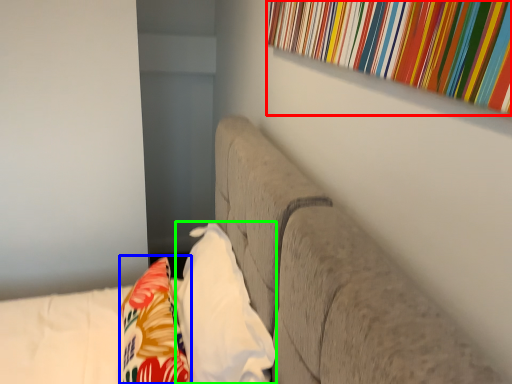
Question: Estimate the real-world distances between objects in this image. Which object is closer to curtain (highlighted by a red box), throw pillow (highlighted by a blue box) or pillow (highlighted by a green box)?

Choices:
 (A) throw pillow
 (B) pillow

Answer: (B)